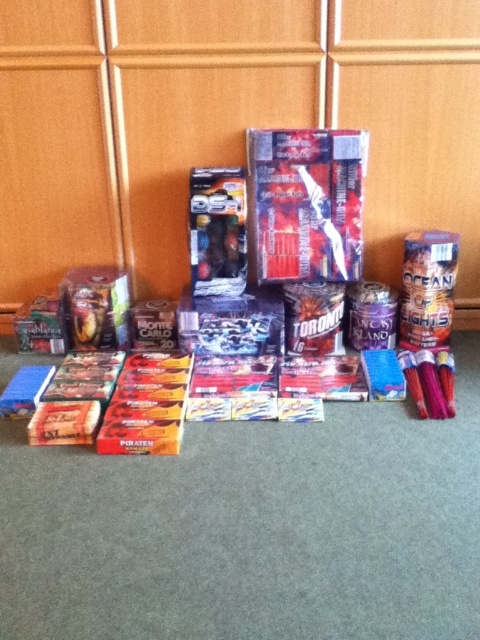
You are a child who wants to pick up the metallic silver toy car at center. You are currently standing 1.69 meters away from it. If your maximum reach without bending is 1.5 meters, can you grab it?

The metallic silver toy car at center is 1.69 meters away from the viewer. Since your maximum reach is 1.5 meters without bending, you cannot grab it without bending down or moving closer.

You are standing in a room with fireworks boxes arranged on the floor. You need to place a new box exactly at the center of the room. The metallic silver fireworks at center is currently at point 0.400, 0.615. Is this box already at the center?

The metallic silver fireworks at center is located at point (x=295, y=256), which indicates it is positioned at the center of the room.

From the picture: You are standing in a room with fireworks boxes and need to reach the shiny metallic box at center. There is a metallic silver fireworks at center blocking your path. Can you step around it to the left or right? Explain why based on their positions.

The metallic silver fireworks at center is closer to the viewer than the shiny metallic box at center. Since the fireworks are in front, you can step around them to the left or right to reach the box behind.